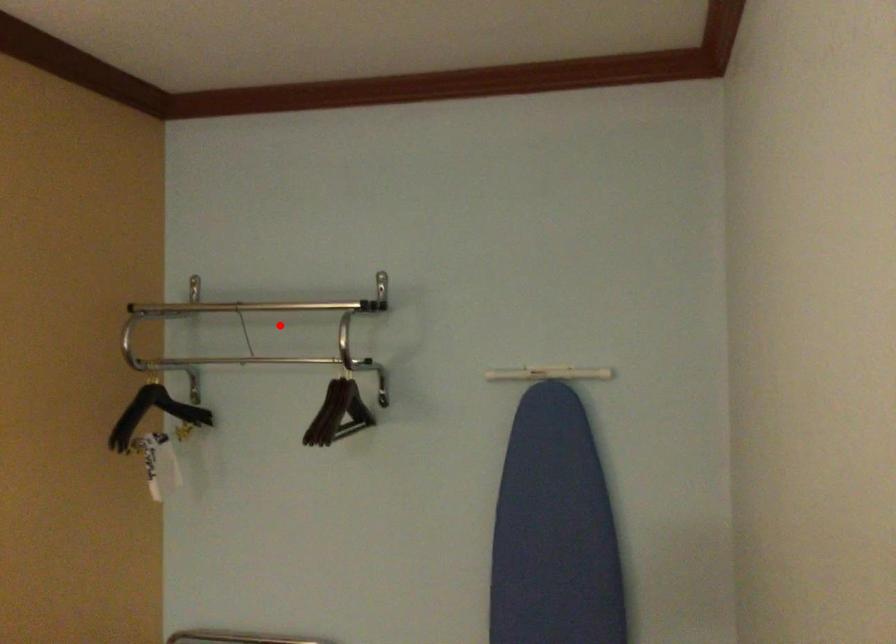
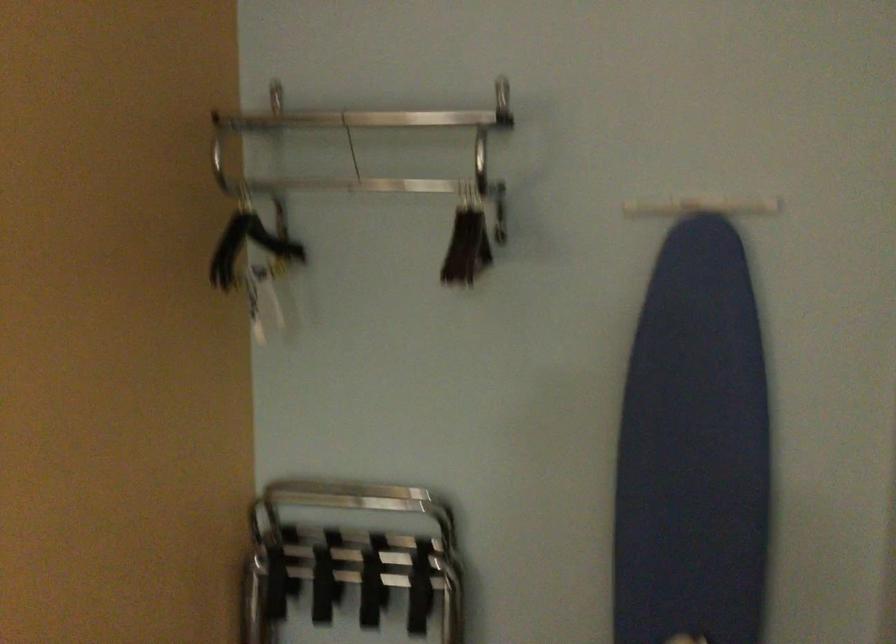
In the second image, find the point that corresponds to the highlighted location in the first image.

(381, 147)